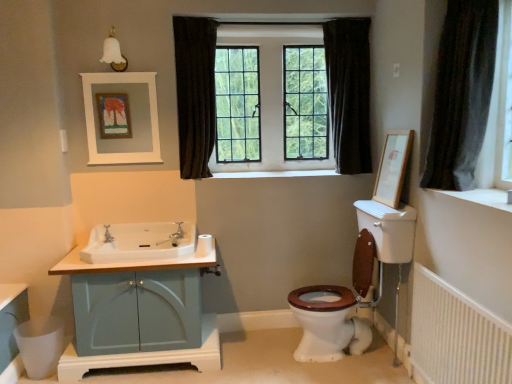
Find the location of a particular element. free area below wooden picture frame at upper right, which is the 1th picture frame in right-to-left order (from a real-world perspective) is located at coordinates (384, 340).